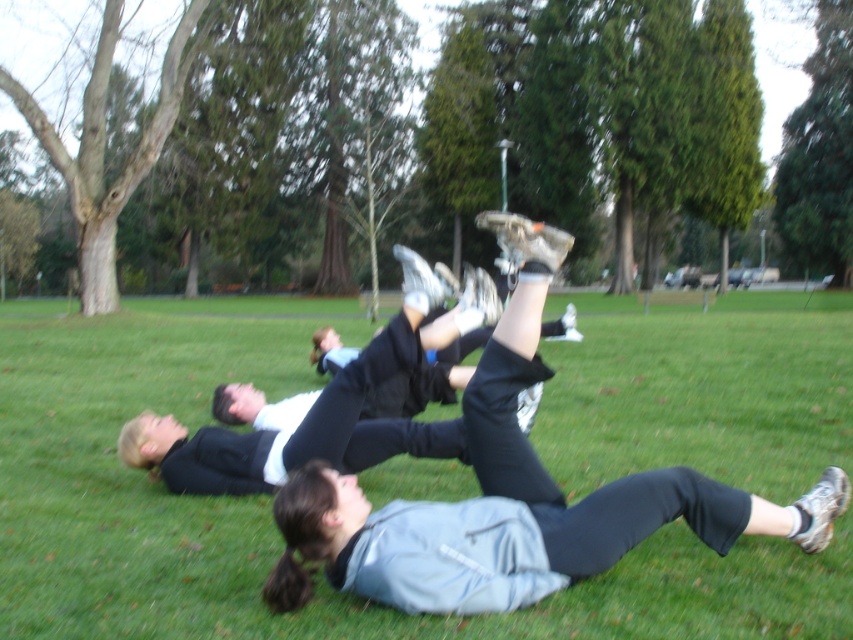
Which is more to the right, green grass at center or black matte pants at center?

From the viewer's perspective, green grass at center appears more on the right side.

Does green grass at center appear on the left side of black matte pants at center?

No, green grass at center is not to the left of black matte pants at center.

Between point (248, 528) and point (363, 440), which one is positioned in front?

Point (248, 528) is more forward.

You are a GUI agent. You are given a task and a screenshot of the screen. Output one action in this format:
    pyautogui.click(x=<x>, y=<y>)
    Task: Click on the green grass at center
    The image size is (853, 640).
    Given the screenshot: What is the action you would take?
    pyautogui.click(x=270, y=502)